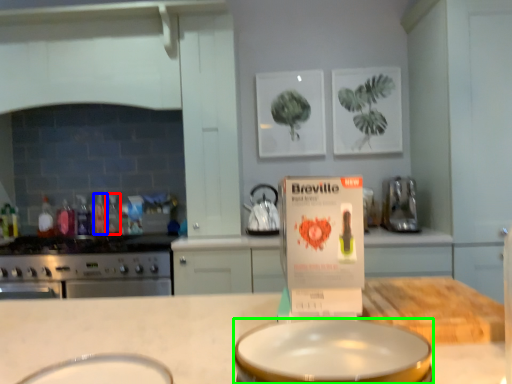
Question: Considering the real-world distances, which object is closest to bottle (highlighted by a red box)? bottle (highlighted by a blue box) or basin (highlighted by a green box).

Choices:
 (A) bottle
 (B) basin

Answer: (A)